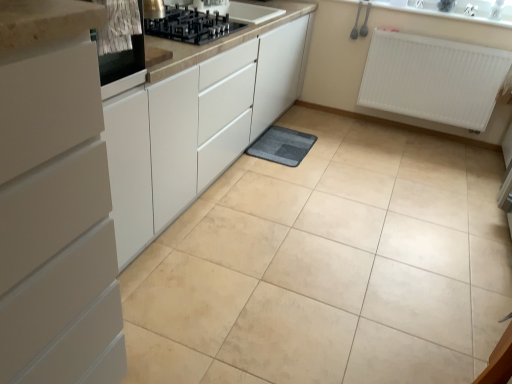
Question: Is gray soft mat at center further to camera compared to white plastic radiator at upper right?

Choices:
 (A) yes
 (B) no

Answer: (B)

Question: Is the position of gray soft mat at center less distant than that of white plastic radiator at upper right?

Choices:
 (A) no
 (B) yes

Answer: (B)

Question: From the image's perspective, is gray soft mat at center beneath white plastic radiator at upper right?

Choices:
 (A) yes
 (B) no

Answer: (A)

Question: Does gray soft mat at center appear on the left side of white plastic radiator at upper right?

Choices:
 (A) yes
 (B) no

Answer: (A)

Question: Is gray soft mat at center facing away from white plastic radiator at upper right?

Choices:
 (A) no
 (B) yes

Answer: (A)

Question: Would you say gray soft mat at center is outside white plastic radiator at upper right?

Choices:
 (A) yes
 (B) no

Answer: (A)

Question: Does white matte cabinet at left come behind metallic stainless steel oven at upper left?

Choices:
 (A) yes
 (B) no

Answer: (B)

Question: From a real-world perspective, is white matte cabinet at left physically below metallic stainless steel oven at upper left?

Choices:
 (A) no
 (B) yes

Answer: (B)

Question: Could you tell me if white matte cabinet at left is facing metallic stainless steel oven at upper left?

Choices:
 (A) no
 (B) yes

Answer: (A)

Question: Can you confirm if white matte cabinet at left is taller than metallic stainless steel oven at upper left?

Choices:
 (A) no
 (B) yes

Answer: (B)

Question: Can you confirm if white matte cabinet at left is bigger than metallic stainless steel oven at upper left?

Choices:
 (A) yes
 (B) no

Answer: (A)

Question: From a real-world perspective, is white matte cabinet at left over metallic stainless steel oven at upper left?

Choices:
 (A) yes
 (B) no

Answer: (B)

Question: Is metallic stainless steel oven at upper left in contact with white matte cabinet at left?

Choices:
 (A) yes
 (B) no

Answer: (B)